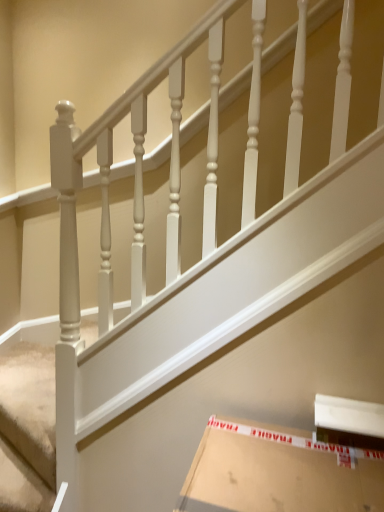
What do you see at coordinates (279, 472) in the screenshot? I see `white cardboard box at lower right` at bounding box center [279, 472].

The width and height of the screenshot is (384, 512). I want to click on white cardboard box at lower right, so click(279, 472).

Describe the element at coordinates (27, 428) in the screenshot. I see `white textured carpet at lower left` at that location.

The image size is (384, 512). Find the location of `white textured carpet at lower left`. white textured carpet at lower left is located at coordinates (27, 428).

This screenshot has width=384, height=512. What are the coordinates of `white cardboard box at lower right` in the screenshot? It's located at (279, 472).

Is white textured carpet at lower left at the right side of white cardboard box at lower right?

Incorrect, white textured carpet at lower left is not on the right side of white cardboard box at lower right.

Does white textured carpet at lower left come in front of white cardboard box at lower right?

No, white textured carpet at lower left is behind white cardboard box at lower right.

Is point (47, 385) positioned in front of point (299, 510)?

No, (47, 385) is behind (299, 510).

From the image's perspective, is white textured carpet at lower left located above white cardboard box at lower right?

Yes, from the image's perspective, white textured carpet at lower left is over white cardboard box at lower right.

From a real-world perspective, relative to white cardboard box at lower right, is white textured carpet at lower left vertically above or below?

In terms of real-world spatial position, white textured carpet at lower left is below white cardboard box at lower right.

Between white textured carpet at lower left and white cardboard box at lower right, which one has larger width?

white cardboard box at lower right is wider.

Is white textured carpet at lower left taller than white cardboard box at lower right?

In fact, white textured carpet at lower left may be shorter than white cardboard box at lower right.

Who is bigger, white textured carpet at lower left or white cardboard box at lower right?

With larger size is white cardboard box at lower right.

Can we say white textured carpet at lower left lies outside white cardboard box at lower right?

Yes, white textured carpet at lower left is outside of white cardboard box at lower right.

Is there a large distance between white textured carpet at lower left and white cardboard box at lower right?

That's right, there is a large distance between white textured carpet at lower left and white cardboard box at lower right.

Could you tell me if white textured carpet at lower left is facing white cardboard box at lower right?

No, white textured carpet at lower left is not facing towards white cardboard box at lower right.

This screenshot has width=384, height=512. Identify the location of cardboard box on the right of the white textured carpet at lower left. (279, 472).

Does white cardboard box at lower right appear on the right side of white textured carpet at lower left?

Indeed, white cardboard box at lower right is positioned on the right side of white textured carpet at lower left.

Which object is closer to the camera taking this photo, white cardboard box at lower right or white textured carpet at lower left?

white cardboard box at lower right is more forward.

Is point (346, 492) closer or farther from the camera than point (42, 410)?

Point (346, 492).

From the image's perspective, between white cardboard box at lower right and white textured carpet at lower left, who is located below?

white cardboard box at lower right appears lower in the image.

From a real-world perspective, is white cardboard box at lower right physically below white textured carpet at lower left?

No.

Can you confirm if white cardboard box at lower right is wider than white textured carpet at lower left?

Yes, white cardboard box at lower right is wider than white textured carpet at lower left.

Who is shorter, white cardboard box at lower right or white textured carpet at lower left?

Standing shorter between the two is white textured carpet at lower left.

Between white cardboard box at lower right and white textured carpet at lower left, which one has smaller size?

With smaller size is white textured carpet at lower left.

From the picture: Is white textured carpet at lower left completely or partially inside white cardboard box at lower right?

No, white textured carpet at lower left is located outside of white cardboard box at lower right.

From the picture: Is white cardboard box at lower right next to white textured carpet at lower left and touching it?

They are not placed beside each other.

Is white cardboard box at lower right aimed at white textured carpet at lower left?

No, white cardboard box at lower right is not turned towards white textured carpet at lower left.

In the image, there is a white textured carpet at lower left. Where is `cardboard box below it (from the image's perspective)`? cardboard box below it (from the image's perspective) is located at coordinates (279, 472).

Locate an element on the screen. stairwell on the left of white cardboard box at lower right is located at coordinates (27, 428).

At what (x,y) coordinates should I click in order to perform the action: click on stairwell below the white cardboard box at lower right (from a real-world perspective). Please return your answer as a coordinate pair (x, y). Looking at the image, I should click on (27, 428).